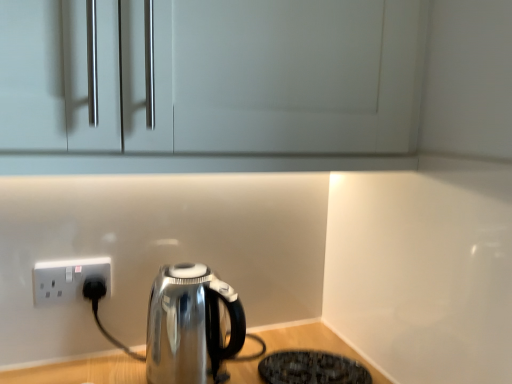
The height and width of the screenshot is (384, 512). What do you see at coordinates (68, 279) in the screenshot? I see `white plastic socket at lower left` at bounding box center [68, 279].

Where is `shiny metallic kettle at lower left`? This screenshot has width=512, height=384. shiny metallic kettle at lower left is located at coordinates (190, 325).

From a real-world perspective, between white plastic socket at lower left and shiny metallic kettle at lower left, who is vertically higher?

From a 3D spatial view, white plastic socket at lower left is above.

Would you say white plastic socket at lower left is a long distance from shiny metallic kettle at lower left?

No, white plastic socket at lower left is not far away from shiny metallic kettle at lower left.

Is white plastic socket at lower left shorter than shiny metallic kettle at lower left?

Correct, white plastic socket at lower left is not as tall as shiny metallic kettle at lower left.

Considering the relative sizes of shiny metallic kettle at lower left and white plastic socket at lower left in the image provided, is shiny metallic kettle at lower left smaller than white plastic socket at lower left?

Actually, shiny metallic kettle at lower left might be larger than white plastic socket at lower left.

What's the angular difference between shiny metallic kettle at lower left and white plastic socket at lower left's facing directions?

There is a 2.19-degree angle between the facing directions of shiny metallic kettle at lower left and white plastic socket at lower left.

From the image's perspective, does shiny metallic kettle at lower left appear higher than white plastic socket at lower left?

No, from the image's perspective, shiny metallic kettle at lower left is not over white plastic socket at lower left.

Based on the photo, which is in front, shiny metallic kettle at lower left or white plastic socket at lower left?

shiny metallic kettle at lower left.

From the image's perspective, between black textured mat at lower right and white plastic socket at lower left, which one is located above?

white plastic socket at lower left appears higher in the image.

Could white plastic socket at lower left be considered to be inside black textured mat at lower right?

Actually, white plastic socket at lower left is outside black textured mat at lower right.

Who is bigger, black textured mat at lower right or white plastic socket at lower left?

With larger size is black textured mat at lower right.

Is point (332, 357) less distant than point (110, 277)?

No, it is not.

Is white plastic socket at lower left facing away from black textured mat at lower right?

No, white plastic socket at lower left's orientation is not away from black textured mat at lower right.

Does white plastic socket at lower left have a greater width compared to black textured mat at lower right?

Incorrect, the width of white plastic socket at lower left does not surpass that of black textured mat at lower right.

From a real-world perspective, which is physically above, white plastic socket at lower left or black textured mat at lower right?

white plastic socket at lower left is physically above.

Is black textured mat at lower right located within white plastic socket at lower left?

Actually, black textured mat at lower right is outside white plastic socket at lower left.

Is there a large distance between shiny metallic kettle at lower left and black textured mat at lower right?

Actually, shiny metallic kettle at lower left and black textured mat at lower right are a little close together.

Consider the image. Is the position of shiny metallic kettle at lower left more distant than that of black textured mat at lower right?

That is False.

From a real-world perspective, is shiny metallic kettle at lower left positioned above or below black textured mat at lower right?

Clearly, from a real-world perspective, shiny metallic kettle at lower left is above black textured mat at lower right.

Can you confirm if shiny metallic kettle at lower left is bigger than black textured mat at lower right?

Yes, shiny metallic kettle at lower left is bigger than black textured mat at lower right.

Is point (306, 375) closer to camera compared to point (163, 322)?

No, (306, 375) is further to viewer.

From a real-world perspective, which object rests below the other?

In real-world perspective, black textured mat at lower right is lower.

Could you tell me if black textured mat at lower right is turned towards shiny metallic kettle at lower left?

No, black textured mat at lower right is not aimed at shiny metallic kettle at lower left.

Is black textured mat at lower right beside shiny metallic kettle at lower left?

There is a gap between black textured mat at lower right and shiny metallic kettle at lower left.

Identify the location of power plugs and sockets above the shiny metallic kettle at lower left (from the image's perspective). (68, 279).

Identify the location of kettle below the white plastic socket at lower left (from a real-world perspective). (190, 325).

When comparing their distances from white plastic socket at lower left, does shiny metallic kettle at lower left or black textured mat at lower right seem closer?

shiny metallic kettle at lower left is closer to white plastic socket at lower left.

Estimate the real-world distances between objects in this image. Which object is closer to shiny metallic kettle at lower left, black textured mat at lower right or white plastic socket at lower left?

black textured mat at lower right.

Which object lies further to the anchor point white plastic socket at lower left, black textured mat at lower right or shiny metallic kettle at lower left?

Based on the image, black textured mat at lower right appears to be further to white plastic socket at lower left.

Estimate the real-world distances between objects in this image. Which object is closer to black textured mat at lower right, shiny metallic kettle at lower left or white plastic socket at lower left?

shiny metallic kettle at lower left lies closer to black textured mat at lower right than the other object.

Which object lies nearer to the anchor point black textured mat at lower right, white plastic socket at lower left or shiny metallic kettle at lower left?

shiny metallic kettle at lower left is closer to black textured mat at lower right.

Based on their spatial positions, is white plastic socket at lower left or black textured mat at lower right further from shiny metallic kettle at lower left?

Based on the image, white plastic socket at lower left appears to be further to shiny metallic kettle at lower left.

The height and width of the screenshot is (384, 512). Identify the location of kettle situated between white plastic socket at lower left and black textured mat at lower right from left to right. (190, 325).